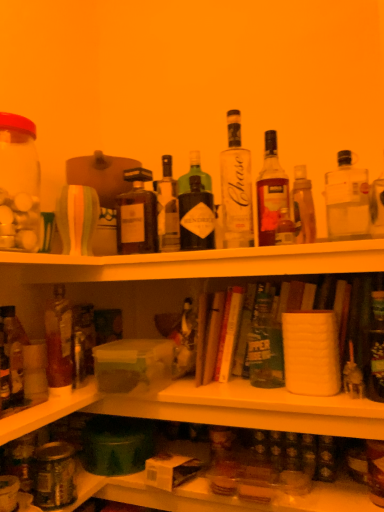
Question: Does green matte beer bottle at center, placed as the 5th bottle when sorted from right to left, have a lesser height compared to translucent glass bottle at left, positioned as the 1th bottle in left-to-right order?

Choices:
 (A) yes
 (B) no

Answer: (A)

Question: Does green matte beer bottle at center, placed as the 5th bottle when sorted from right to left, contain translucent glass bottle at left, positioned as the 1th bottle in left-to-right order?

Choices:
 (A) yes
 (B) no

Answer: (B)

Question: From a real-world perspective, is green matte beer bottle at center, placed as the 5th bottle when sorted from right to left, below translucent glass bottle at left, positioned as the 1th bottle in left-to-right order?

Choices:
 (A) yes
 (B) no

Answer: (B)

Question: From a real-world perspective, is green matte beer bottle at center, acting as the 6th bottle starting from the left, positioned over translucent glass bottle at left, positioned as the 1th bottle in left-to-right order, based on gravity?

Choices:
 (A) no
 (B) yes

Answer: (B)

Question: Does green matte beer bottle at center, placed as the 5th bottle when sorted from right to left, have a greater height compared to translucent glass bottle at left, positioned as the 1th bottle in left-to-right order?

Choices:
 (A) yes
 (B) no

Answer: (B)

Question: Is translucent glass jar at left taller or shorter than translucent glass bottle at left, placed as the 2th bottle when sorted from left to right?

Choices:
 (A) tall
 (B) short

Answer: (A)

Question: Considering the positions of point (26, 212) and point (61, 385), is point (26, 212) closer or farther from the camera than point (61, 385)?

Choices:
 (A) farther
 (B) closer

Answer: (B)

Question: Based on their sizes in the image, would you say translucent glass jar at left is bigger or smaller than translucent glass bottle at left, which appears as the ninth bottle when viewed from the right?

Choices:
 (A) small
 (B) big

Answer: (B)

Question: Is translucent glass jar at left wider or thinner than translucent glass bottle at left, which appears as the ninth bottle when viewed from the right?

Choices:
 (A) wide
 (B) thin

Answer: (A)

Question: From their relative heights in the image, would you say green matte beer bottle at center, placed as the 5th bottle when sorted from right to left, is taller or shorter than matte glass bottle at center, which is the 8th bottle from right to left?

Choices:
 (A) short
 (B) tall

Answer: (A)

Question: From a real-world perspective, is green matte beer bottle at center, acting as the 6th bottle starting from the left, above or below matte glass bottle at center, placed as the 3th bottle when sorted from left to right?

Choices:
 (A) above
 (B) below

Answer: (B)

Question: Considering the positions of green matte beer bottle at center, acting as the 6th bottle starting from the left, and matte glass bottle at center, which is the 8th bottle from right to left, in the image, is green matte beer bottle at center, acting as the 6th bottle starting from the left, wider or thinner than matte glass bottle at center, which is the 8th bottle from right to left,?

Choices:
 (A) thin
 (B) wide

Answer: (B)

Question: From the image's perspective, relative to matte glass bottle at center, placed as the 3th bottle when sorted from left to right, is green matte beer bottle at center, placed as the 5th bottle when sorted from right to left, above or below?

Choices:
 (A) above
 (B) below

Answer: (B)

Question: From their relative heights in the image, would you say translucent glass bottle at lower right, which is the 10th bottle from left to right, is taller or shorter than matte glass bottle at center, which is the 8th bottle from right to left?

Choices:
 (A) tall
 (B) short

Answer: (B)

Question: Is point (372, 361) closer or farther from the camera than point (150, 246)?

Choices:
 (A) closer
 (B) farther

Answer: (A)